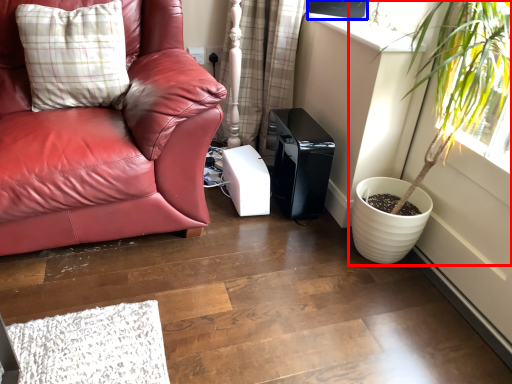
Question: Which point is further to the camera, houseplant (highlighted by a red box) or window screen (highlighted by a blue box)?

Choices:
 (A) houseplant
 (B) window screen

Answer: (B)